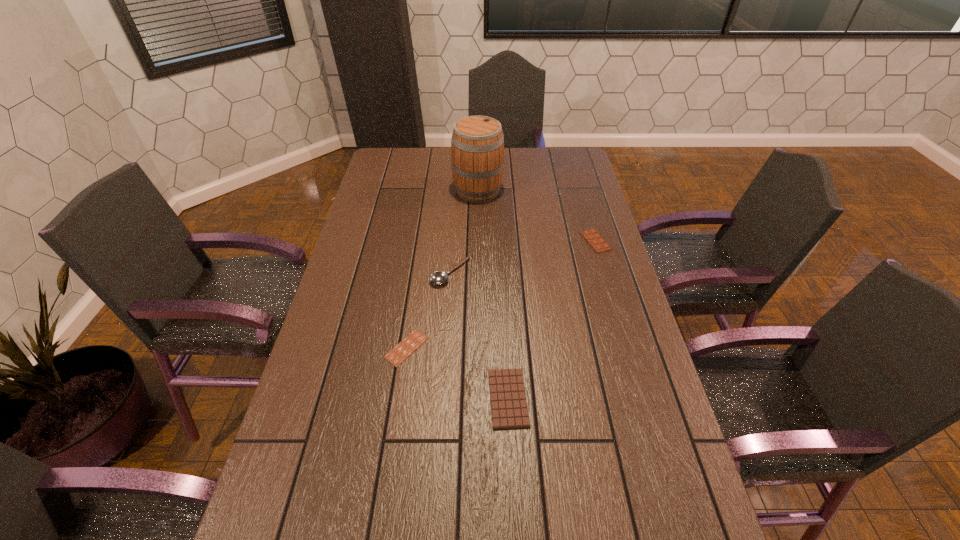
Identify which object is the third nearest to the tallest object. Please provide its 2D coordinates. Your answer should be formatted as a tuple, i.e. [(x, y)], where the tuple contains the x and y coordinates of a point satisfying the conditions above.

[(396, 356)]

What are the coordinates of `object that stands as the closest to the ladle` in the screenshot? It's located at (396, 356).

Point out which chocolate bar is positioned as the nearest to the nearest chocolate bar. Please provide its 2D coordinates. Your answer should be formatted as a tuple, i.e. [(x, y)], where the tuple contains the x and y coordinates of a point satisfying the conditions above.

[(396, 356)]

Identify which chocolate bar is the second nearest to the tallest object. Please provide its 2D coordinates. Your answer should be formatted as a tuple, i.e. [(x, y)], where the tuple contains the x and y coordinates of a point satisfying the conditions above.

[(396, 356)]

Locate an element on the screen. This screenshot has width=960, height=540. free space in the image that satisfies the following two spatial constraints: 1. on the front side of the second chocolate bar from left to right; 2. on the right side of the tallest object is located at coordinates (476, 398).

Locate an element on the screen. The image size is (960, 540). free spot that satisfies the following two spatial constraints: 1. on the back side of the nearest object; 2. on the left side of the rightmost object is located at coordinates (500, 241).

In order to click on vacant area in the image that satisfies the following two spatial constraints: 1. on the back side of the second tallest object; 2. on the left side of the second farthest chocolate bar in this screenshot , I will do `click(418, 272)`.

Where is `free region that satisfies the following two spatial constraints: 1. on the back side of the farthest chocolate bar; 2. on the right side of the second tallest object`? The image size is (960, 540). free region that satisfies the following two spatial constraints: 1. on the back side of the farthest chocolate bar; 2. on the right side of the second tallest object is located at coordinates (453, 241).